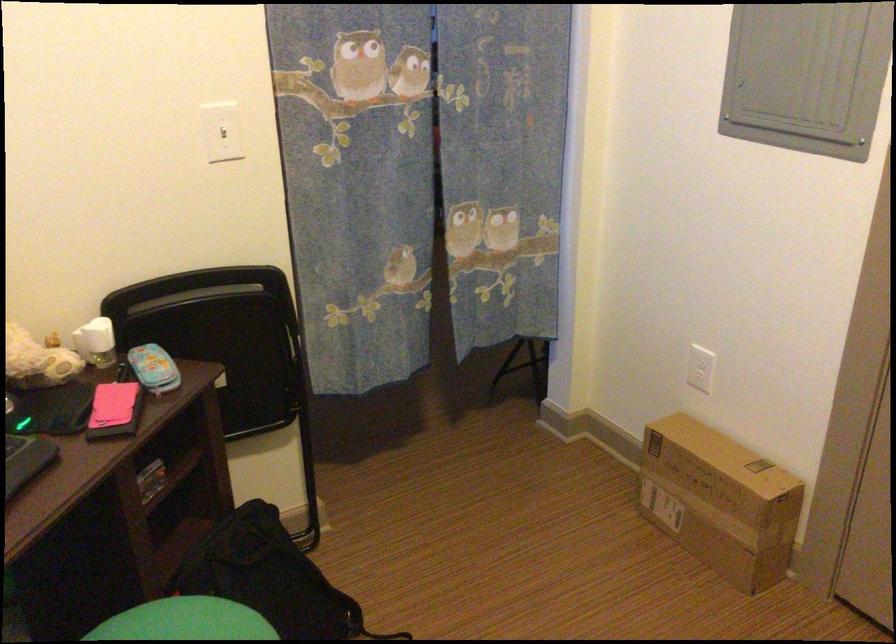
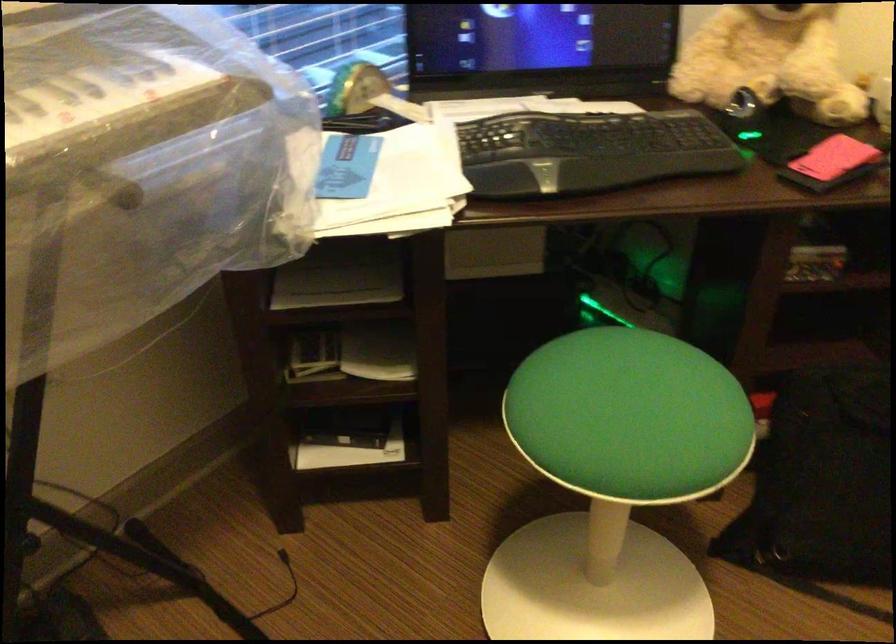
The images are taken continuously from a first-person perspective. In which direction is your viewpoint rotating?

The rotation direction of the camera is left-down.